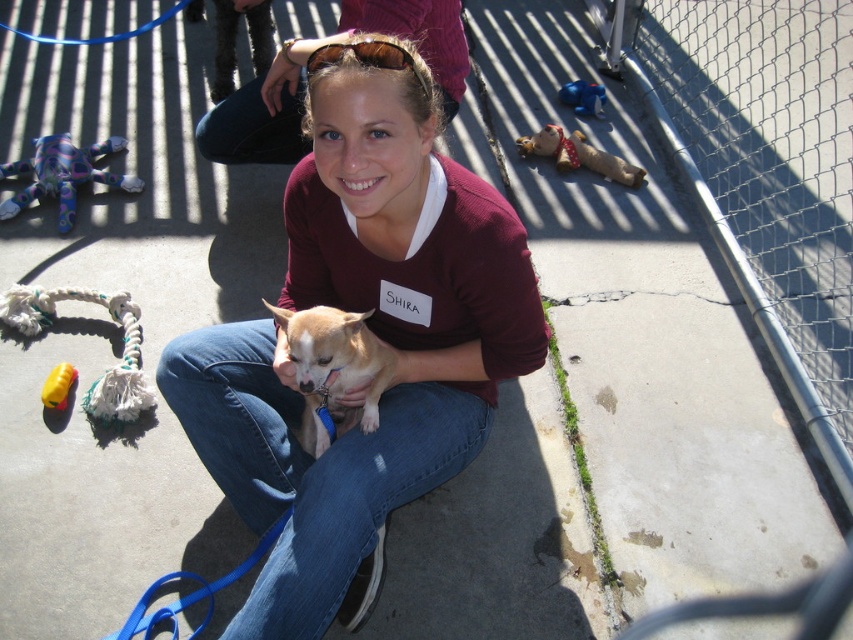
Question: Which object appears closest to the camera in this image?

Choices:
 (A) light brown plush toy at upper right
 (B) matte maroon sweater at center

Answer: (B)

Question: Which of these objects is positioned closest to the brown fur dog at center?

Choices:
 (A) blue plush toy at upper center
 (B) matte maroon sweater at center
 (C) yellow rubber toy at lower left

Answer: (A)

Question: In this image, where is matte maroon sweater at center located relative to blue plush toy at upper center?

Choices:
 (A) right
 (B) left

Answer: (B)

Question: Which point appears farthest from the camera in this image?

Choices:
 (A) (140, 182)
 (B) (62, 392)

Answer: (A)

Question: Is matte maroon sweater at center above plush multicolored stuffed animal at left?

Choices:
 (A) yes
 (B) no

Answer: (B)

Question: Can you confirm if brown fur dog at center is smaller than yellow rubber toy at lower left?

Choices:
 (A) yes
 (B) no

Answer: (B)